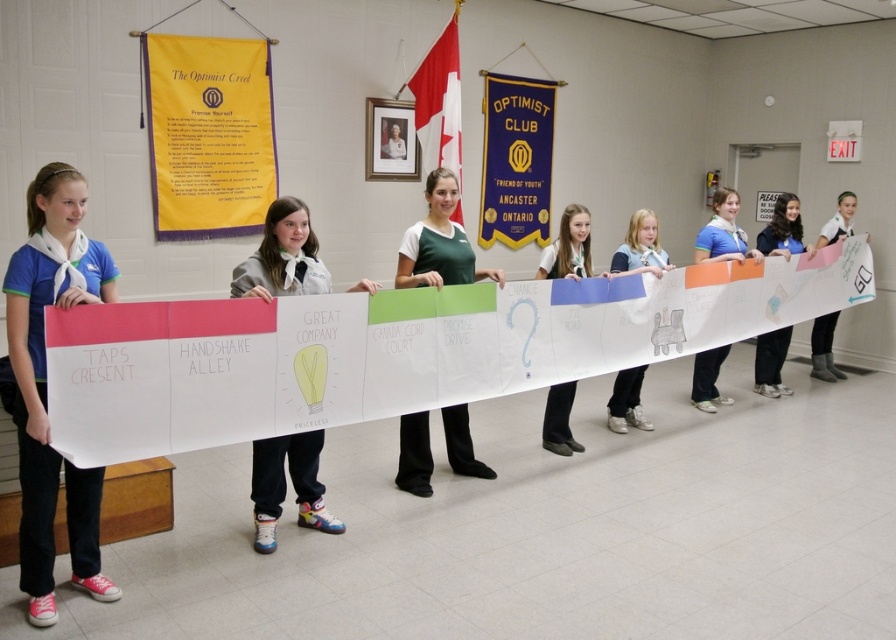
Question: Does yellow fabric banner at upper left have a lesser width compared to matte white banner at center?

Choices:
 (A) no
 (B) yes

Answer: (A)

Question: Among these points, which one is nearest to the camera?

Choices:
 (A) (537, 278)
 (B) (257, 80)

Answer: (A)

Question: Does white paper banner at center have a greater width compared to matte white banner at center?

Choices:
 (A) yes
 (B) no

Answer: (A)

Question: Among these points, which one is nearest to the camera?

Choices:
 (A) (556, 262)
 (B) (659, 276)
 (C) (431, 401)
 (D) (168, 76)

Answer: (C)

Question: Observing the image, what is the correct spatial positioning of yellow fabric banner at upper left in reference to matte white banner at center?

Choices:
 (A) left
 (B) right

Answer: (A)

Question: Which object is farther from the camera taking this photo?

Choices:
 (A) yellow fabric banner at upper left
 (B) matte white banner at center
 (C) white glossy banner at center
 (D) white paper banner at center

Answer: (A)